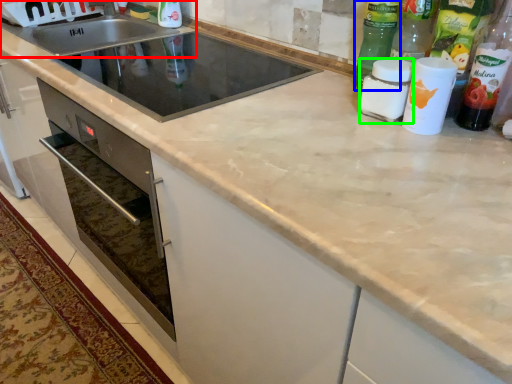
Question: Which object is positioned farthest from sink (highlighted by a red box)? Select from bottle (highlighted by a blue box) and bottle (highlighted by a green box).

Choices:
 (A) bottle
 (B) bottle

Answer: (B)